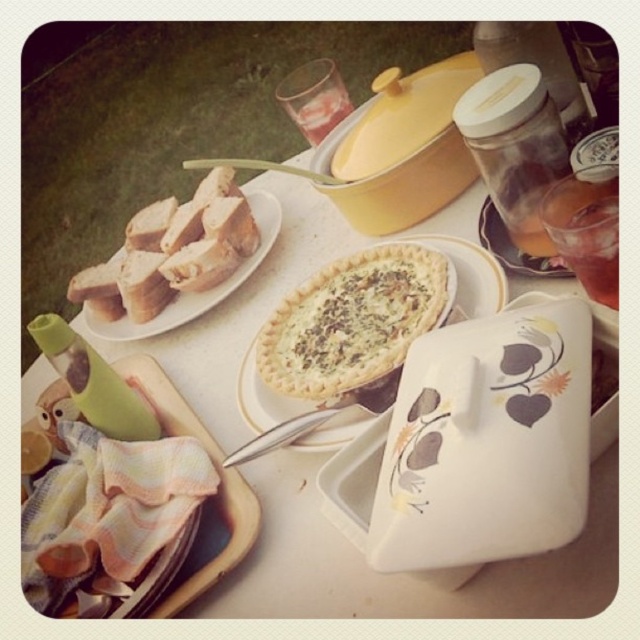
Who is more distant from viewer, (493, 264) or (502, 230)?

The point (502, 230) is behind.

Does golden flaky pie at center come in front of translucent glass at upper right?

Yes, golden flaky pie at center is in front of translucent glass at upper right.

Image resolution: width=640 pixels, height=640 pixels. I want to click on golden flaky pie at center, so click(465, 275).

Can you confirm if white ceramic tray at lower left is positioned above white ceramic plate at upper left?

Incorrect, white ceramic tray at lower left is not positioned above white ceramic plate at upper left.

Between point (182, 400) and point (83, 314), which one is positioned in front?

Point (182, 400) is more forward.

Find the location of a particular element. Image resolution: width=640 pixels, height=640 pixels. white ceramic tray at lower left is located at coordinates (216, 467).

Between golden flaky pie at center and white ceramic plate at upper left, which one appears on the left side from the viewer's perspective?

white ceramic plate at upper left is more to the left.

You are a GUI agent. You are given a task and a screenshot of the screen. Output one action in this format:
    pyautogui.click(x=<x>, y=<y>)
    Task: Click on the golden flaky pie at center
    Image resolution: width=640 pixels, height=640 pixels.
    Given the screenshot: What is the action you would take?
    pyautogui.click(x=465, y=275)